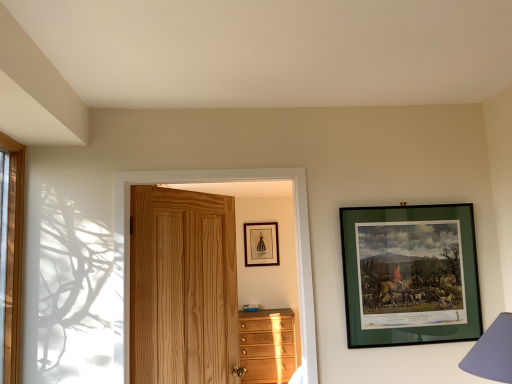
Question: Considering the relative sizes of green matte picture frame at upper right, the 1th picture frame when ordered from right to left, and light brown wooden chest of drawers at lower center in the image provided, is green matte picture frame at upper right, the 1th picture frame when ordered from right to left, shorter than light brown wooden chest of drawers at lower center?

Choices:
 (A) yes
 (B) no

Answer: (A)

Question: Does green matte picture frame at upper right, marked as the second picture frame in a back-to-front arrangement, have a larger size compared to light brown wooden chest of drawers at lower center?

Choices:
 (A) yes
 (B) no

Answer: (B)

Question: From a real-world perspective, is green matte picture frame at upper right, which is counted as the first picture frame, starting from the front, positioned over light brown wooden chest of drawers at lower center based on gravity?

Choices:
 (A) no
 (B) yes

Answer: (B)

Question: Is green matte picture frame at upper right, the 1th picture frame when ordered from right to left, further to the viewer compared to light brown wooden chest of drawers at lower center?

Choices:
 (A) yes
 (B) no

Answer: (B)

Question: Is light brown wooden chest of drawers at lower center at the back of green matte picture frame at upper right, the second picture frame from the left?

Choices:
 (A) no
 (B) yes

Answer: (B)

Question: Is purple fabric lampshade at lower right wider or thinner than light brown wooden chest of drawers at lower center?

Choices:
 (A) wide
 (B) thin

Answer: (B)

Question: In the image, is purple fabric lampshade at lower right on the left side or the right side of light brown wooden chest of drawers at lower center?

Choices:
 (A) left
 (B) right

Answer: (B)

Question: From a real-world perspective, is purple fabric lampshade at lower right physically located above or below light brown wooden chest of drawers at lower center?

Choices:
 (A) above
 (B) below

Answer: (A)

Question: Considering the positions of purple fabric lampshade at lower right and light brown wooden chest of drawers at lower center in the image, is purple fabric lampshade at lower right bigger or smaller than light brown wooden chest of drawers at lower center?

Choices:
 (A) small
 (B) big

Answer: (A)

Question: Is point (344, 216) positioned closer to the camera than point (501, 314)?

Choices:
 (A) closer
 (B) farther

Answer: (B)

Question: From a real-world perspective, is green matte picture frame at upper right, marked as the second picture frame in a back-to-front arrangement, positioned above or below purple fabric lampshade at lower right?

Choices:
 (A) above
 (B) below

Answer: (A)

Question: Considering the positions of green matte picture frame at upper right, the 1th picture frame when ordered from right to left, and purple fabric lampshade at lower right in the image, is green matte picture frame at upper right, the 1th picture frame when ordered from right to left, wider or thinner than purple fabric lampshade at lower right?

Choices:
 (A) wide
 (B) thin

Answer: (B)

Question: From their relative heights in the image, would you say green matte picture frame at upper right, which is counted as the first picture frame, starting from the front, is taller or shorter than purple fabric lampshade at lower right?

Choices:
 (A) short
 (B) tall

Answer: (B)

Question: Is light brown wooden chest of drawers at lower center wider or thinner than purple fabric lampshade at lower right?

Choices:
 (A) thin
 (B) wide

Answer: (B)

Question: Choose the correct answer: Is light brown wooden chest of drawers at lower center inside purple fabric lampshade at lower right or outside it?

Choices:
 (A) outside
 (B) inside

Answer: (A)